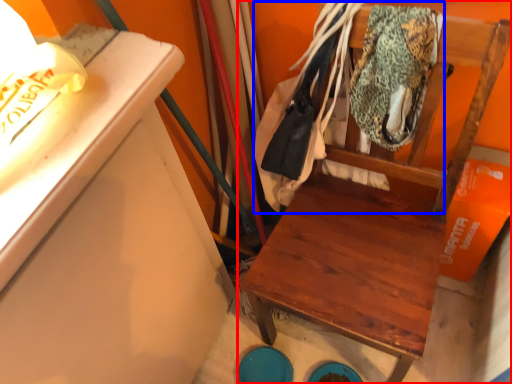
Question: Which object appears farthest to the camera in this image, furniture (highlighted by a red box) or laundry (highlighted by a blue box)?

Choices:
 (A) furniture
 (B) laundry

Answer: (B)